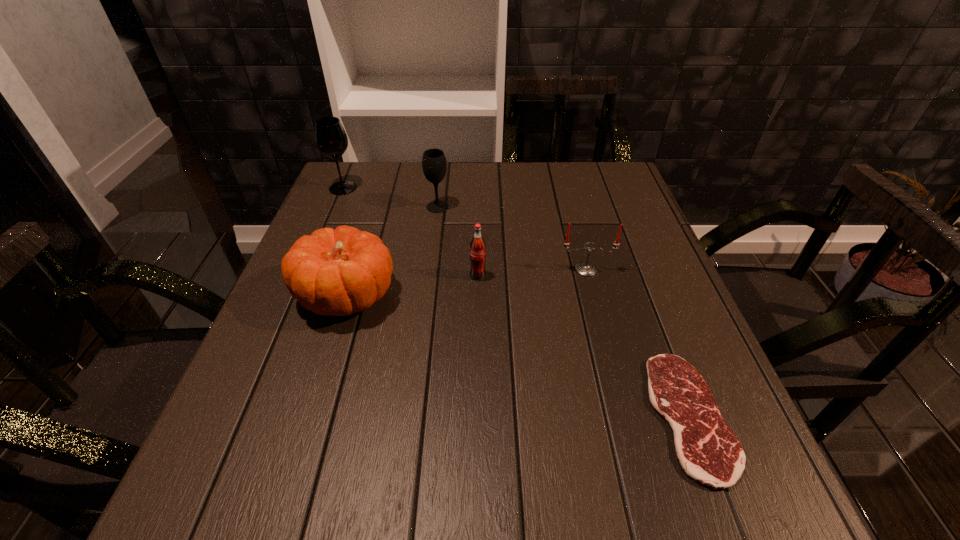
Find the location of `free space that is in between the soda bottle and the steak`. free space that is in between the soda bottle and the steak is located at coordinates (584, 346).

Locate an element on the screen. This screenshot has height=540, width=960. free area in between the left wineglass and the candle is located at coordinates (465, 228).

The height and width of the screenshot is (540, 960). Identify the location of blank region between the candle and the steak. (637, 343).

Identify the location of free space that is in between the pumpkin and the shorter wineglass. (393, 251).

The height and width of the screenshot is (540, 960). In order to click on free space between the fourth object from right to left and the steak in this screenshot , I will do `click(564, 312)`.

Locate an element on the screen. This screenshot has height=540, width=960. empty space between the steak and the pumpkin is located at coordinates (518, 356).

Where is `free spot between the nearest object and the soda bottle`? free spot between the nearest object and the soda bottle is located at coordinates (584, 346).

Image resolution: width=960 pixels, height=540 pixels. I want to click on the third closest object to the fourth object from right to left, so click(x=477, y=245).

Select which object appears as the third closest to the shortest object. Please provide its 2D coordinates. Your answer should be formatted as a tuple, i.e. [(x, y)], where the tuple contains the x and y coordinates of a point satisfying the conditions above.

[(339, 272)]

Locate an element on the screen. free point that satisfies the following two spatial constraints: 1. on the front-facing side of the steak; 2. on the left side of the candle is located at coordinates (625, 416).